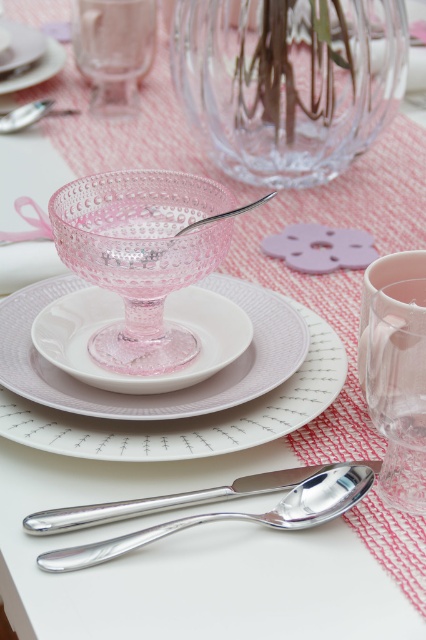
Which is more to the left, transparent glass vase at upper center or transparent glass saucer at center?

From the viewer's perspective, transparent glass saucer at center appears more on the left side.

Does transparent glass vase at upper center come in front of transparent glass saucer at center?

No, it is not.

This screenshot has height=640, width=426. What are the coordinates of `transparent glass vase at upper center` in the screenshot? It's located at (287, 81).

I want to click on transparent glass vase at upper center, so click(287, 81).

Who is shorter, transparent glass saucer at center or silver metallic spoon at center?

Standing shorter between the two is silver metallic spoon at center.

Is transparent glass saucer at center closer to camera compared to silver metallic spoon at center?

No.

Does point (48, 348) come farther from viewer compared to point (267, 198)?

No, it is not.

This screenshot has width=426, height=640. I want to click on transparent glass saucer at center, so click(121, 323).

This screenshot has height=640, width=426. Describe the element at coordinates (141, 257) in the screenshot. I see `pink crystal bowl at center` at that location.

From the picture: Does pink crystal bowl at center have a larger size compared to pink textured glass at center?

Actually, pink crystal bowl at center might be smaller than pink textured glass at center.

The height and width of the screenshot is (640, 426). What do you see at coordinates (141, 257) in the screenshot? I see `pink crystal bowl at center` at bounding box center [141, 257].

You are a GUI agent. You are given a task and a screenshot of the screen. Output one action in this format:
    pyautogui.click(x=<x>, y=<y>)
    Task: Click on the pink crystal bowl at center
    This screenshot has width=426, height=640.
    Given the screenshot: What is the action you would take?
    pyautogui.click(x=141, y=257)